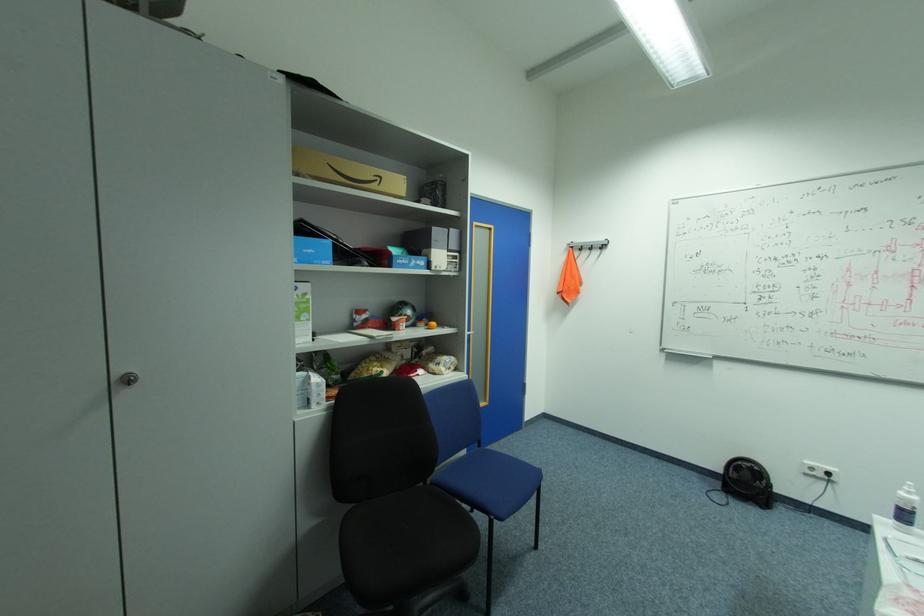
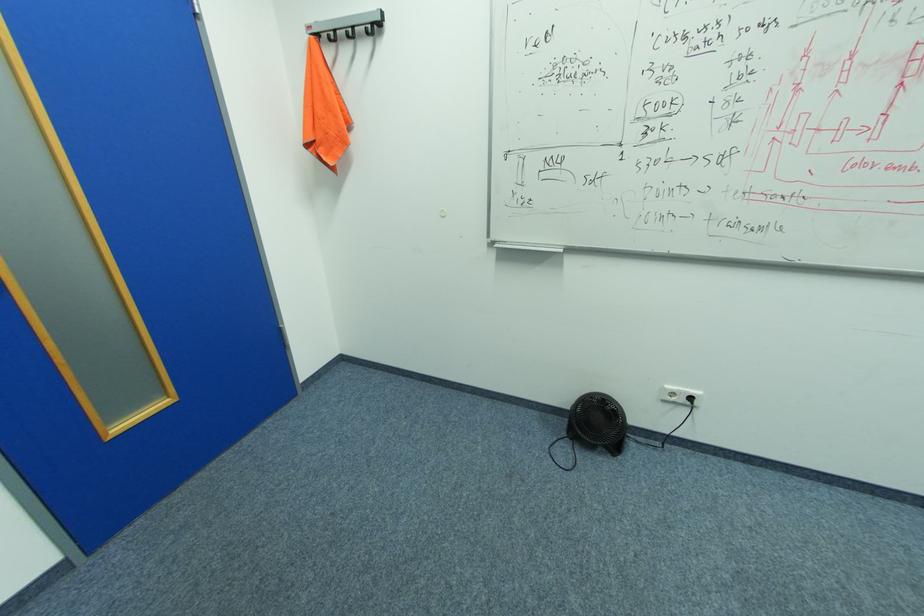
In the second image, find the point that corresponds to pixel 810 464 in the first image.

(670, 387)